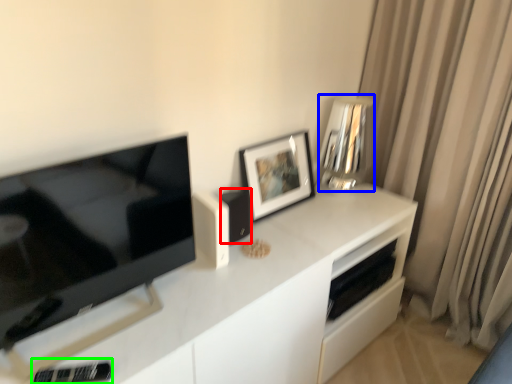
Question: Which object is positioned closest to appliance (highlighted by a red box)? Select from appliance (highlighted by a blue box) and appliance (highlighted by a green box).

Choices:
 (A) appliance
 (B) appliance

Answer: (A)